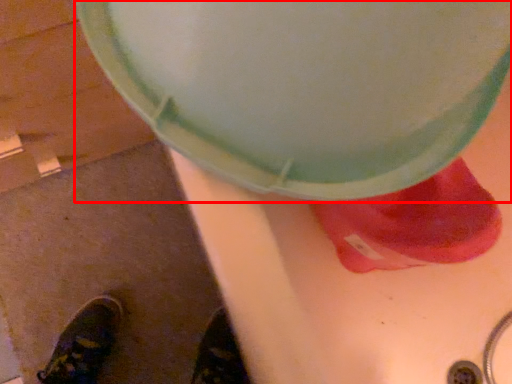
Question: Where is lid (annotated by the red box) located in relation to footwear in the image?

Choices:
 (A) left
 (B) right

Answer: (A)